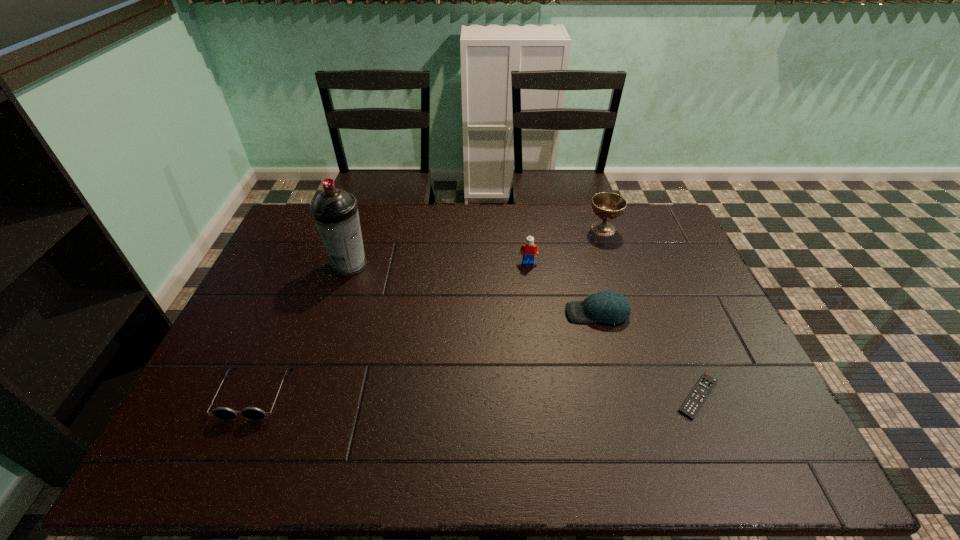
You are a GUI agent. You are given a task and a screenshot of the screen. Output one action in this format:
    pyautogui.click(x=<x>, y=<y>)
    Task: Click on the aerosol can
    
    Given the screenshot: What is the action you would take?
    pyautogui.click(x=335, y=211)

Identify the location of the farthest object. (607, 206).

Image resolution: width=960 pixels, height=540 pixels. Find the location of `Lego`. Lego is located at coordinates (530, 250).

Image resolution: width=960 pixels, height=540 pixels. Find the location of `baseball cap`. baseball cap is located at coordinates (608, 307).

Identify the location of the third shortest object. The width and height of the screenshot is (960, 540). (608, 307).

At what (x,y) coordinates should I click in order to perform the action: click on the fifth tallest object. Please return your answer as a coordinate pair (x, y). Looking at the image, I should click on (224, 413).

The image size is (960, 540). In order to click on the shortest object in this screenshot , I will do `click(702, 389)`.

Locate an element on the screen. vacant space located on the front of the aerosol can is located at coordinates (318, 361).

The image size is (960, 540). Find the location of `vacant area situated 0.350m on the left of the chalice`. vacant area situated 0.350m on the left of the chalice is located at coordinates (490, 230).

Locate an element on the screen. The width and height of the screenshot is (960, 540). vacant area located 0.190m on the face of the Lego is located at coordinates (534, 307).